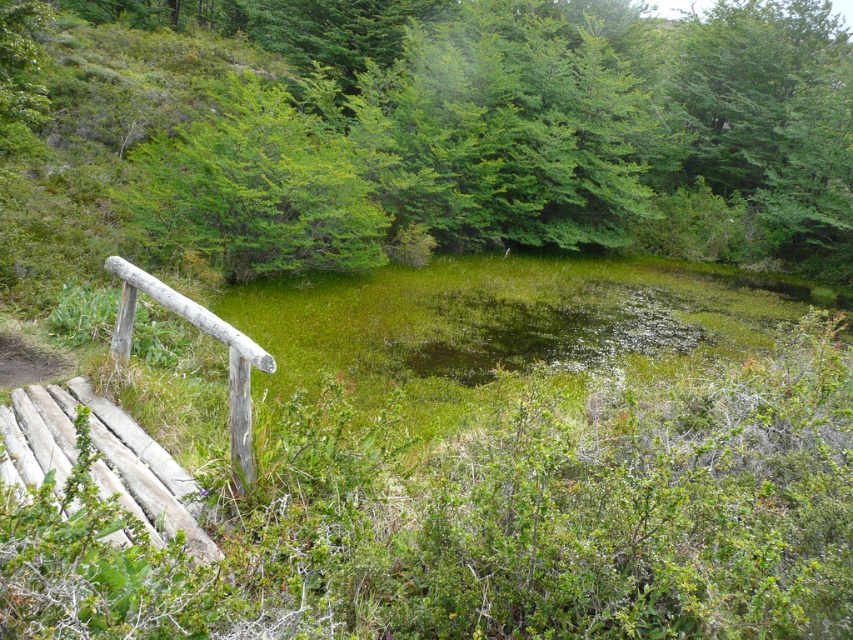
Which is more to the right, green leafy tree at center or green leafy tree at upper center?

green leafy tree at center

Which is in front, point (482, 208) or point (187, 136)?

Point (187, 136) is in front.

You are a GUI agent. You are given a task and a screenshot of the screen. Output one action in this format:
    pyautogui.click(x=<x>, y=<y>)
    Task: Click on the green leafy tree at center
    The height and width of the screenshot is (640, 853).
    Given the screenshot: What is the action you would take?
    pyautogui.click(x=445, y=129)

Can you confirm if green leafy tree at center is smaller than weathered wood rail at left?

Incorrect, green leafy tree at center is not smaller in size than weathered wood rail at left.

Does green leafy tree at center have a lesser height compared to weathered wood rail at left?

Incorrect, green leafy tree at center's height does not fall short of weathered wood rail at left's.

Image resolution: width=853 pixels, height=640 pixels. Identify the location of green leafy tree at center. (445, 129).

Is green leafy tree at upper center bigger than weathered wood rail at left?

Indeed, green leafy tree at upper center has a larger size compared to weathered wood rail at left.

From the picture: Between green leafy tree at upper center and weathered wood rail at left, which one is positioned lower?

weathered wood rail at left

This screenshot has height=640, width=853. What do you see at coordinates (256, 189) in the screenshot?
I see `green leafy tree at upper center` at bounding box center [256, 189].

This screenshot has width=853, height=640. I want to click on green leafy tree at upper center, so (256, 189).